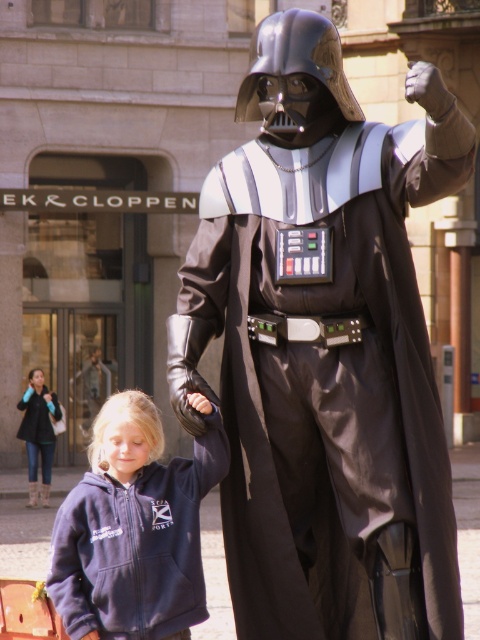
Question: Considering the relative positions of navy fleece hoodie at lower left and denim jacket at lower left in the image provided, where is navy fleece hoodie at lower left located with respect to denim jacket at lower left?

Choices:
 (A) right
 (B) left

Answer: (A)

Question: Can you confirm if shiny black costume at center is positioned to the right of navy fleece hoodie at lower left?

Choices:
 (A) yes
 (B) no

Answer: (A)

Question: Which point is farther to the camera?

Choices:
 (A) navy fleece hoodie at lower left
 (B) denim jacket at lower left

Answer: (B)

Question: Which object is closer to the camera taking this photo?

Choices:
 (A) denim jacket at lower left
 (B) shiny black costume at center

Answer: (B)

Question: Which object is positioned closest to the navy fleece hoodie at lower left?

Choices:
 (A) denim jacket at lower left
 (B) shiny black costume at center

Answer: (B)

Question: Does shiny black costume at center appear on the right side of navy fleece hoodie at lower left?

Choices:
 (A) yes
 (B) no

Answer: (A)